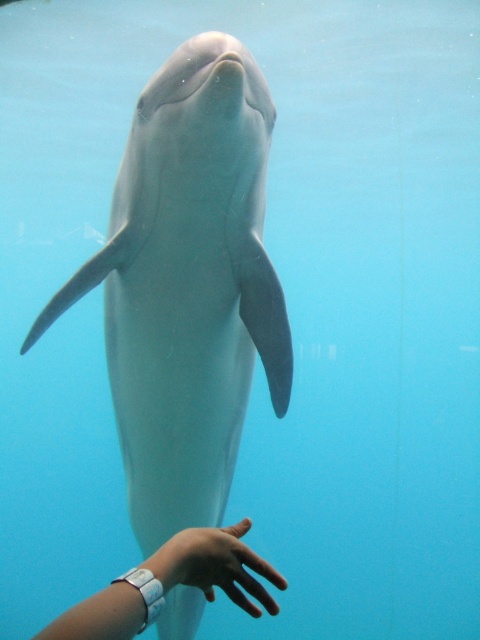
Is smooth gray dolphin at center taller than smooth skin hand at center?

Correct, smooth gray dolphin at center is much taller as smooth skin hand at center.

How much distance is there between smooth gray dolphin at center and smooth skin hand at center?

smooth gray dolphin at center and smooth skin hand at center are 3.52 feet apart.

Describe the element at coordinates (188, 285) in the screenshot. Image resolution: width=480 pixels, height=640 pixels. I see `smooth gray dolphin at center` at that location.

The width and height of the screenshot is (480, 640). What are the coordinates of `smooth gray dolphin at center` in the screenshot? It's located at (188, 285).

Is white rubber watch at lower center below smooth skin hand at center?

Yes, white rubber watch at lower center is below smooth skin hand at center.

Is white rubber watch at lower center thinner than smooth skin hand at center?

No.

At what (x,y) coordinates should I click in order to perform the action: click on white rubber watch at lower center. Please return your answer as a coordinate pair (x, y). Looking at the image, I should click on tap(173, 584).

Locate an element on the screen. The image size is (480, 640). white rubber watch at lower center is located at coordinates (173, 584).

Between smooth gray dolphin at center and white rubber watch at lower center, which one is positioned lower?

white rubber watch at lower center is below.

Consider the image. Between smooth gray dolphin at center and white rubber watch at lower center, which one has less height?

white rubber watch at lower center is shorter.

Locate an element on the screen. smooth gray dolphin at center is located at coordinates (188, 285).

Find the location of a particular element. smooth gray dolphin at center is located at coordinates (188, 285).